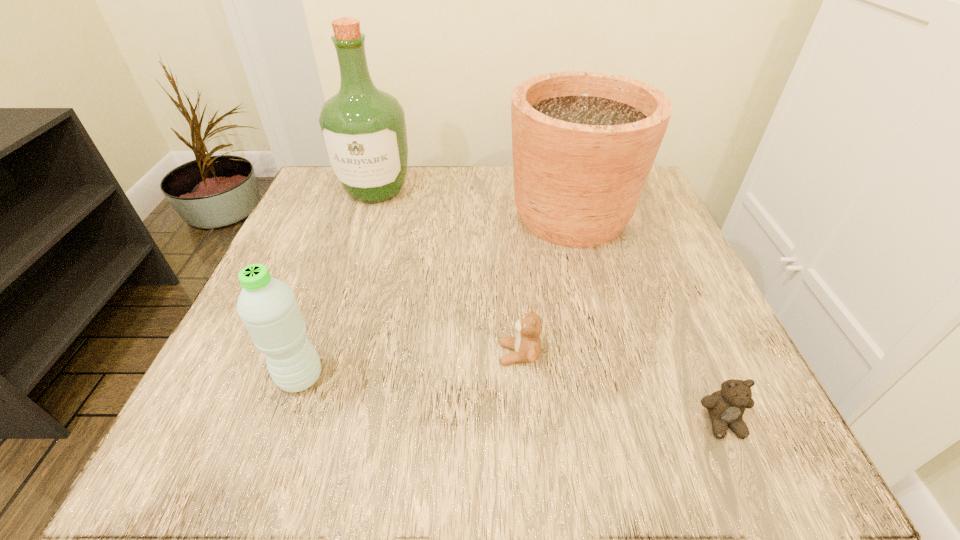
The image size is (960, 540). What are the coordinates of `object that is at the far right corner` in the screenshot? It's located at (584, 143).

Where is `object that is at the near right corner`? The image size is (960, 540). object that is at the near right corner is located at coordinates (726, 407).

You are a GUI agent. You are given a task and a screenshot of the screen. Output one action in this format:
    pyautogui.click(x=<x>, y=<y>)
    Task: Click on the vacant region at the far edge
    Image resolution: width=960 pixels, height=540 pixels.
    Given the screenshot: What is the action you would take?
    pyautogui.click(x=431, y=216)

Locate an element on the screen. free space at the near edge is located at coordinates (498, 456).

At what (x,y) coordinates should I click in order to perform the action: click on free spot at the left edge of the desktop. Please return your answer as a coordinate pair (x, y). This screenshot has width=960, height=540. Looking at the image, I should click on (219, 372).

Where is `vacant position at the right edge of the desktop`? vacant position at the right edge of the desktop is located at coordinates (628, 259).

This screenshot has width=960, height=540. What are the coordinates of `free region at the far left corner` in the screenshot? It's located at (335, 211).

In the image, there is a desktop. Where is `vacant space at the near left corner`? vacant space at the near left corner is located at coordinates (211, 411).

In the image, there is a desktop. Identify the location of vacant space at the near right corner. (660, 416).

Find the location of a particular element. free space that is in between the farther teddy bear and the water bottle is located at coordinates (410, 366).